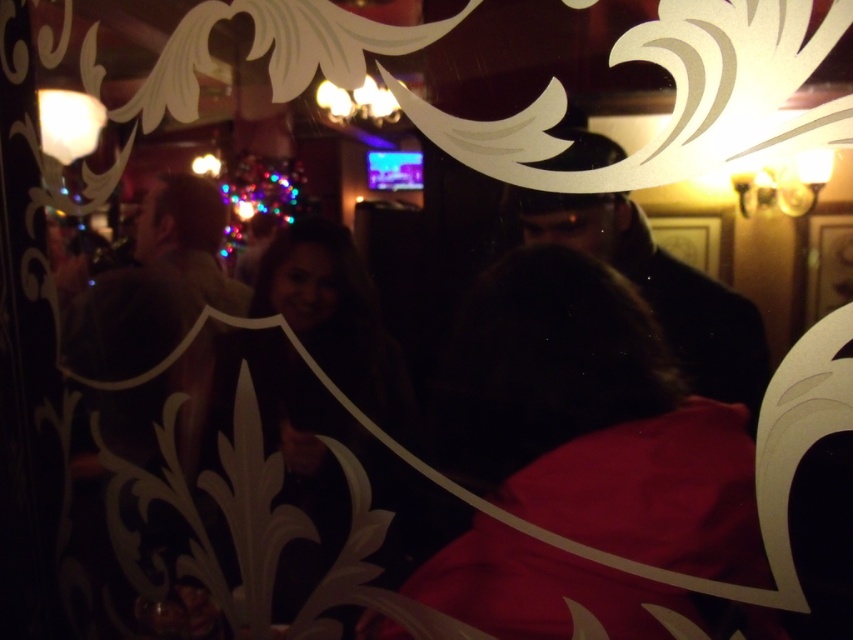
Between dark brown hair at center and dark brown leather jacket at center, which one appears on the right side from the viewer's perspective?

Positioned to the right is dark brown leather jacket at center.

Can you confirm if dark brown hair at center is wider than dark brown leather jacket at center?

Yes, dark brown hair at center is wider than dark brown leather jacket at center.

Is point (381, 467) in front of point (584, 243)?

No, (381, 467) is behind (584, 243).

You are a GUI agent. You are given a task and a screenshot of the screen. Output one action in this format:
    pyautogui.click(x=<x>, y=<y>)
    Task: Click on the dark brown hair at center
    The width and height of the screenshot is (853, 640).
    Given the screenshot: What is the action you would take?
    pos(299,451)

Which is more to the right, matte red coat at center or dark brown hair at center?

Positioned to the right is matte red coat at center.

Is matte red coat at center positioned at the back of dark brown hair at center?

No, matte red coat at center is closer to the viewer.

You are a GUI agent. You are given a task and a screenshot of the screen. Output one action in this format:
    pyautogui.click(x=<x>, y=<y>)
    Task: Click on the matte red coat at center
    The width and height of the screenshot is (853, 640).
    Given the screenshot: What is the action you would take?
    pyautogui.click(x=593, y=420)

The height and width of the screenshot is (640, 853). I want to click on matte red coat at center, so click(593, 420).

From the picture: Is matte red coat at center further to camera compared to dark brown leather jacket at center?

Yes, it is behind dark brown leather jacket at center.

Between matte red coat at center and dark brown leather jacket at center, which one appears on the left side from the viewer's perspective?

Positioned to the left is matte red coat at center.

Which is behind, point (561, 259) or point (584, 221)?

The point (561, 259) is more distant.

What are the coordinates of `matte red coat at center` in the screenshot? It's located at (593, 420).